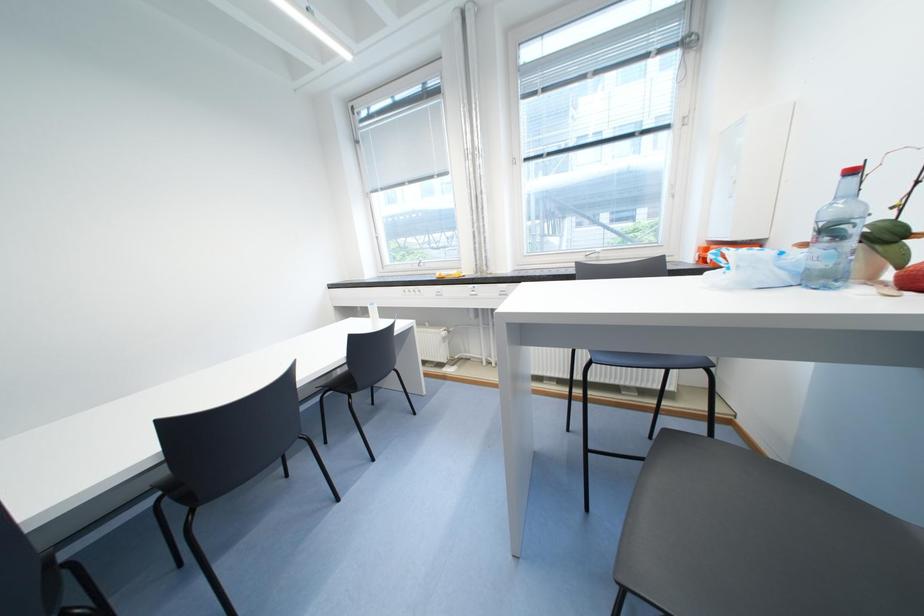
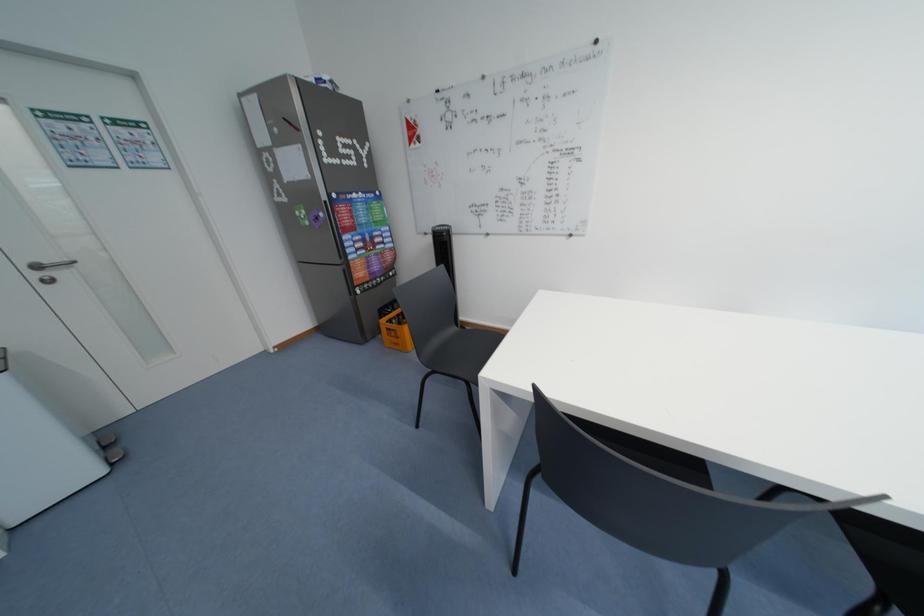
First-person continuous shooting, in which direction is the camera rotating?

The camera rotated toward left-down.